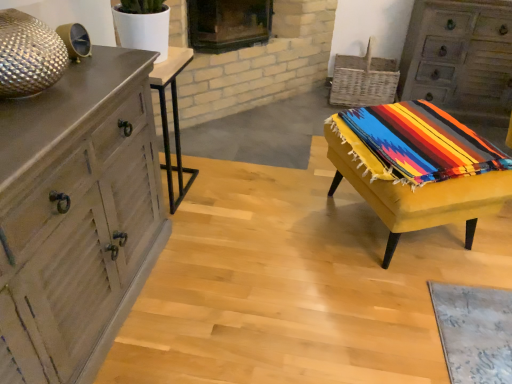
Question: In terms of width, does black glass fireplace at upper center look wider or thinner when compared to wooden chest of drawers at left, the second chest of drawers in the top-to-bottom sequence?

Choices:
 (A) thin
 (B) wide

Answer: (A)

Question: From the image's perspective, is black glass fireplace at upper center positioned above or below wooden chest of drawers at left, which is counted as the 2th chest of drawers, starting from the back?

Choices:
 (A) below
 (B) above

Answer: (B)

Question: Which object is the closest to the wooden table at left, placed as the 2th table when sorted from right to left?

Choices:
 (A) yellow fabric-covered stool at right, acting as the 1th table starting from the right
 (B) wooden chest of drawers at left, which is the first chest of drawers in bottom-to-top order
 (C) rustic wood chest of drawers at upper right, which appears as the first chest of drawers when viewed from the right
 (D) black glass fireplace at upper center

Answer: (D)

Question: Estimate the real-world distances between objects in this image. Which object is farther from the rustic wood chest of drawers at upper right, acting as the 2th chest of drawers starting from the bottom?

Choices:
 (A) wooden chest of drawers at left, placed as the 1th chest of drawers when sorted from front to back
 (B) wooden table at left, which is the first table in left-to-right order
 (C) black glass fireplace at upper center
 (D) yellow fabric-covered stool at right, which is the 2th table from left to right

Answer: (A)